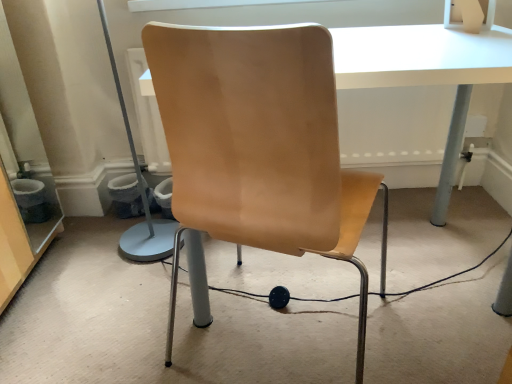
Describe the element at coordinates (424, 72) in the screenshot. I see `white glossy table at center` at that location.

Looking at this image, in order to face white glossy table at center, should I rotate leftwards or rightwards?

You should rotate right by 12.162 degrees.

Where is `white glossy table at center`? white glossy table at center is located at coordinates (424, 72).

The image size is (512, 384). Describe the element at coordinates (258, 144) in the screenshot. I see `matte wood chair at center` at that location.

Locate an element on the screen. matte wood chair at center is located at coordinates (258, 144).

The image size is (512, 384). I want to click on white glossy table at center, so click(x=424, y=72).

Is matte wood chair at center to the left of white glossy table at center from the viewer's perspective?

Yes, matte wood chair at center is to the left of white glossy table at center.

Is matte wood chair at center further to camera compared to white glossy table at center?

No.

Is point (222, 214) less distant than point (439, 35)?

Yes, it is.

From the image's perspective, is matte wood chair at center above white glossy table at center?

No, from the image's perspective, matte wood chair at center is not above white glossy table at center.

Based on the photo, from a real-world perspective, between matte wood chair at center and white glossy table at center, who is vertically higher?

matte wood chair at center is physically above.

Is matte wood chair at center wider or thinner than white glossy table at center?

Clearly, matte wood chair at center has less width compared to white glossy table at center.

Considering the sizes of objects matte wood chair at center and white glossy table at center in the image provided, who is shorter, matte wood chair at center or white glossy table at center?

white glossy table at center is shorter.

Who is bigger, matte wood chair at center or white glossy table at center?

white glossy table at center is bigger.

Does matte wood chair at center contain white glossy table at center?

No, matte wood chair at center does not contain white glossy table at center.

Is matte wood chair at center touching white glossy table at center?

No, matte wood chair at center is not with white glossy table at center.

Is matte wood chair at center oriented away from white glossy table at center?

Correct, matte wood chair at center is looking away from white glossy table at center.

Can you tell me how much matte wood chair at center and white glossy table at center differ in facing direction?

matte wood chair at center and white glossy table at center are facing 158 degrees away from each other.

The height and width of the screenshot is (384, 512). In order to click on chair that appears below the white glossy table at center (from the image's perspective) in this screenshot , I will do `click(258, 144)`.

Between white glossy table at center and matte wood chair at center, which one appears on the left side from the viewer's perspective?

matte wood chair at center is more to the left.

Considering the relative positions of white glossy table at center and matte wood chair at center in the image provided, is white glossy table at center behind matte wood chair at center?

Yes, it is behind matte wood chair at center.

Considering the points (438, 55) and (161, 98), which point is in front, point (438, 55) or point (161, 98)?

The point (161, 98) is in front.

From the image's perspective, is white glossy table at center on matte wood chair at center?

Yes.

From a real-world perspective, between white glossy table at center and matte wood chair at center, who is vertically lower?

In real-world perspective, white glossy table at center is lower.

Which of these two, white glossy table at center or matte wood chair at center, is thinner?

Thinner between the two is matte wood chair at center.

Which of these two, white glossy table at center or matte wood chair at center, stands taller?

Standing taller between the two is matte wood chair at center.

Who is bigger, white glossy table at center or matte wood chair at center?

Bigger between the two is white glossy table at center.

Based on the photo, is white glossy table at center positioned beyond the bounds of matte wood chair at center?

Absolutely, white glossy table at center is external to matte wood chair at center.

Is white glossy table at center far from matte wood chair at center?

No, white glossy table at center is not far away from matte wood chair at center.

Is white glossy table at center positioned with its back to matte wood chair at center?

Correct, white glossy table at center is looking away from matte wood chair at center.

In the scene shown: What's the angular difference between white glossy table at center and matte wood chair at center's facing directions?

They differ by 158 degrees in their facing directions.

This screenshot has width=512, height=384. What are the coordinates of `chair on the left of white glossy table at center` in the screenshot? It's located at (258, 144).

The image size is (512, 384). I want to click on table that appears below the matte wood chair at center (from a real-world perspective), so click(x=424, y=72).

I want to click on chair in front of the white glossy table at center, so click(258, 144).